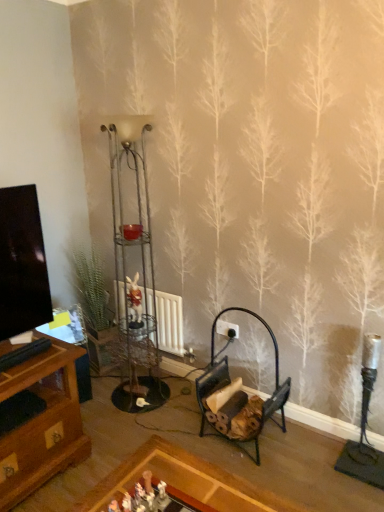
Question: Considering the relative positions of black metal firewood rack at lower center and white glossy rabbit at center, which is the first toy in left-to-right order, in the image provided, is black metal firewood rack at lower center to the left of white glossy rabbit at center, which is the first toy in left-to-right order, from the viewer's perspective?

Choices:
 (A) no
 (B) yes

Answer: (A)

Question: Is white glossy rabbit at center, acting as the first toy starting from the back, inside black metal firewood rack at lower center?

Choices:
 (A) no
 (B) yes

Answer: (A)

Question: Is black metal firewood rack at lower center outside white glossy rabbit at center, which is the first toy in left-to-right order?

Choices:
 (A) yes
 (B) no

Answer: (A)

Question: Is black metal firewood rack at lower center shorter than white glossy rabbit at center, marked as the 2th toy in a front-to-back arrangement?

Choices:
 (A) no
 (B) yes

Answer: (A)

Question: Is the position of black metal firewood rack at lower center more distant than that of white glossy rabbit at center, the 2th toy viewed from the right?

Choices:
 (A) yes
 (B) no

Answer: (B)

Question: From the image's perspective, is white matte radiator at center located above or below white glossy rabbit at center, the 1th toy viewed from the top?

Choices:
 (A) below
 (B) above

Answer: (A)

Question: Which is correct: white matte radiator at center is inside white glossy rabbit at center, which is the first toy in left-to-right order, or outside of it?

Choices:
 (A) outside
 (B) inside

Answer: (A)

Question: Based on their positions, is white matte radiator at center located to the left or right of white glossy rabbit at center, acting as the first toy starting from the back?

Choices:
 (A) left
 (B) right

Answer: (B)

Question: In terms of width, does white matte radiator at center look wider or thinner when compared to white glossy rabbit at center, the 2th toy viewed from the right?

Choices:
 (A) thin
 (B) wide

Answer: (A)

Question: Do you think white plastic toy at center, which appears as the first toy when viewed from the right, is within white matte radiator at center, or outside of it?

Choices:
 (A) outside
 (B) inside

Answer: (A)

Question: From the image's perspective, is white plastic toy at center, which is the 2th toy in left-to-right order, located above or below white matte radiator at center?

Choices:
 (A) above
 (B) below

Answer: (B)

Question: Is white plastic toy at center, acting as the 2th toy starting from the back, wider or thinner than white matte radiator at center?

Choices:
 (A) wide
 (B) thin

Answer: (B)

Question: Considering the positions of white plastic toy at center, arranged as the first toy when viewed from the front, and white matte radiator at center in the image, is white plastic toy at center, arranged as the first toy when viewed from the front, bigger or smaller than white matte radiator at center?

Choices:
 (A) small
 (B) big

Answer: (A)

Question: From the image's perspective, is white plastic toy at center, acting as the 2th toy starting from the back, positioned above or below white glossy rabbit at center, marked as the 2th toy in a front-to-back arrangement?

Choices:
 (A) below
 (B) above

Answer: (A)

Question: Do you think white plastic toy at center, acting as the 2th toy starting from the back, is within white glossy rabbit at center, which is the second toy from bottom to top, or outside of it?

Choices:
 (A) outside
 (B) inside

Answer: (A)